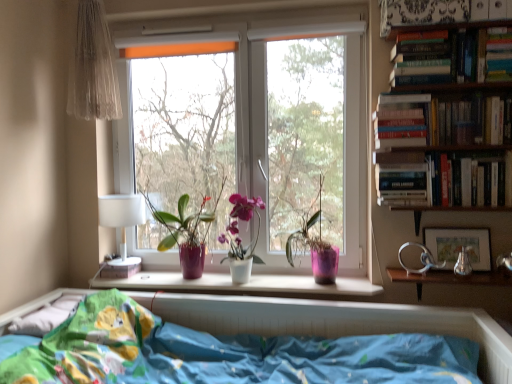
Where is `vacant region under white glossy pot at center, acting as the second houseplant starting from the right (from a real-world perspective)`? The height and width of the screenshot is (384, 512). vacant region under white glossy pot at center, acting as the second houseplant starting from the right (from a real-world perspective) is located at coordinates (243, 283).